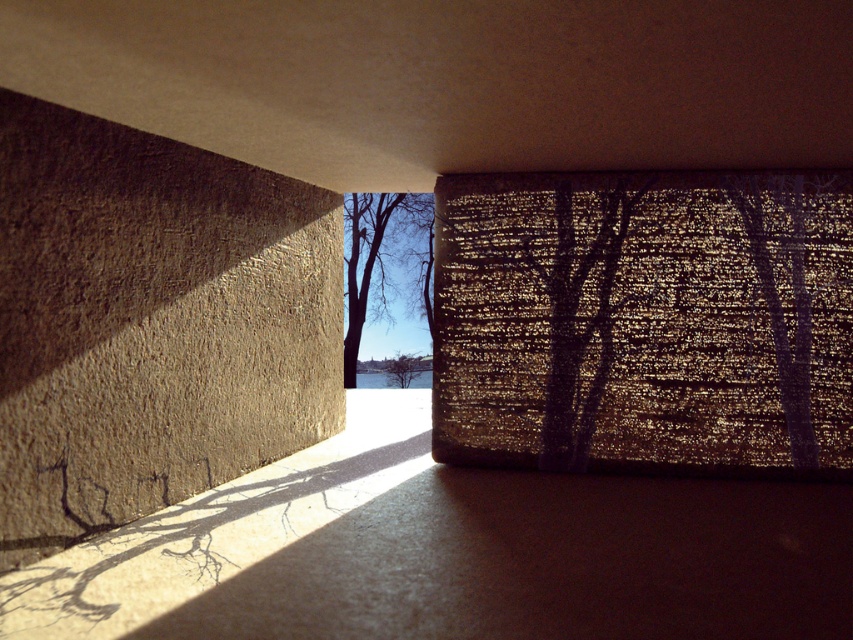
Question: Among these points, which one is nearest to the camera?

Choices:
 (A) (846, 212)
 (B) (820, 518)
 (C) (268, 285)

Answer: (B)

Question: Is bare branches at center to the left of green leafy tree at center from the viewer's perspective?

Choices:
 (A) no
 (B) yes

Answer: (B)

Question: Which point is closer to the camera taking this photo?

Choices:
 (A) (683, 310)
 (B) (355, 244)
 (C) (292, 552)
 (D) (387, 384)

Answer: (C)

Question: Can you confirm if textured glass window at center is smaller than bare branches at center?

Choices:
 (A) yes
 (B) no

Answer: (B)

Question: Does brown rough concrete at left appear on the right side of green leafy tree at center?

Choices:
 (A) yes
 (B) no

Answer: (B)

Question: Which point is farther to the camera?

Choices:
 (A) pos(842,552)
 (B) pos(421,364)

Answer: (B)